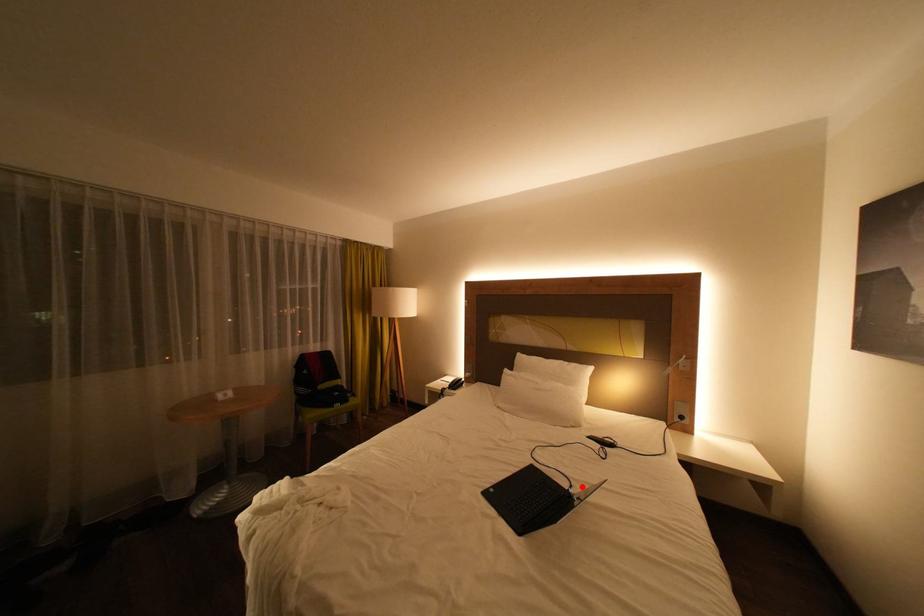
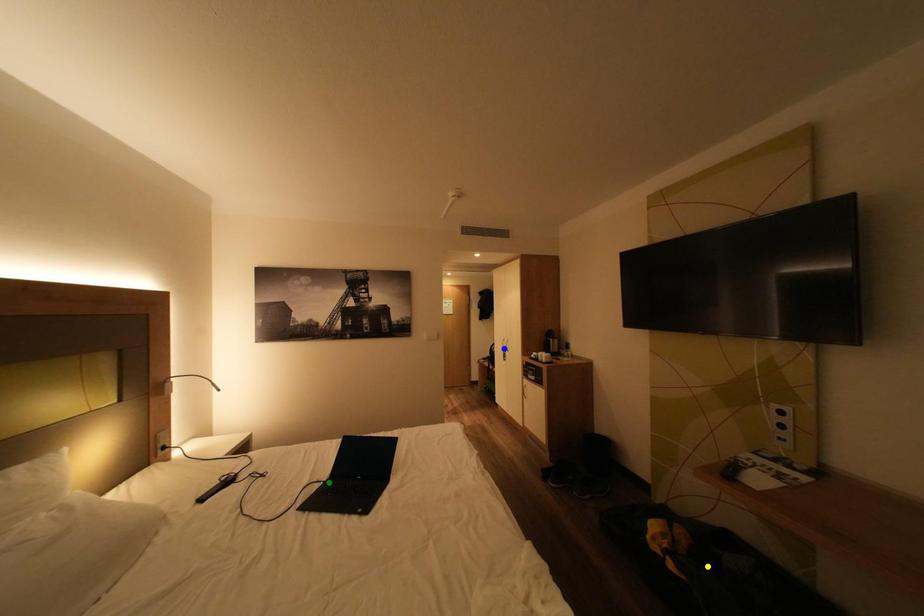
Question: I am providing you with two images of the same scene from different viewpoints. A red point is marked on the first image. You are given multiple points on the second image. In image 2, which mark is for the same physical point as the one in image 1?

Choices:
 (A) green point
 (B) yellow point
 (C) blue point

Answer: (A)